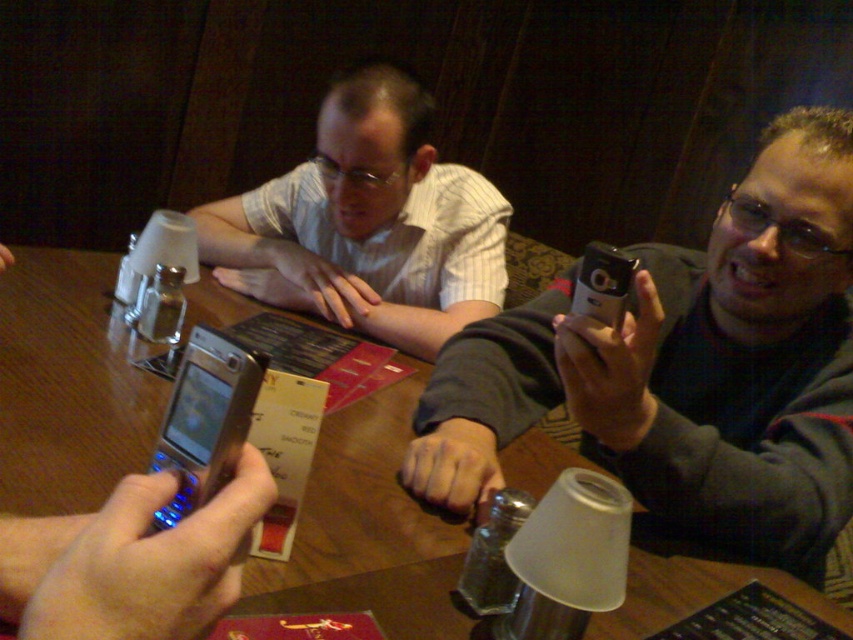
You are a photographer trying to take a picture of the silver metallic phone at upper right from a distance of 30 inches. Can you position your camera so that the phone is in the frame without moving any objects?

The silver metallic phone at upper right and camera are 28.91 inches apart, so yes, you can position your camera within 30 inches to capture the phone in the frame without moving any objects.

Consider the image. You are sitting at the wooden table at center in a dimly lit restaurant. You want to reach for the silver metallic phone at upper right. Can you easily reach it without moving your seat?

The silver metallic phone at upper right is located above wooden table at center, so it might be out of arm reach unless you move your seat.